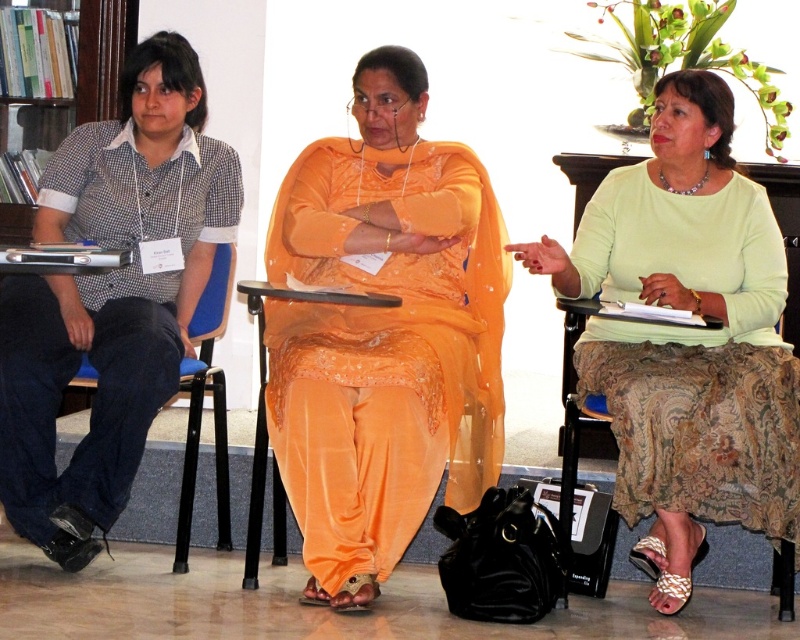
Who is more forward, (234, 170) or (218, 420)?

Point (218, 420) is in front.

You are a GUI agent. You are given a task and a screenshot of the screen. Output one action in this format:
    pyautogui.click(x=<x>, y=<y>)
    Task: Click on the checkered fabric shirt at left
    
    Given the screenshot: What is the action you would take?
    pyautogui.click(x=112, y=296)

Where is `checkered fabric shirt at left`? This screenshot has height=640, width=800. checkered fabric shirt at left is located at coordinates (112, 296).

Does point (444, 236) lie behind point (193, 452)?

That is False.

In the scene shown: Is orange silk dress at center further to camera compared to blue fabric chair at left?

No, orange silk dress at center is closer to the viewer.

Is point (336, 534) closer to camera compared to point (197, 300)?

Yes.

The height and width of the screenshot is (640, 800). Find the location of `orange silk dress at center`. orange silk dress at center is located at coordinates (384, 333).

Does orange silk dress at center have a smaller size compared to green satin blouse at center?

Yes.

Does orange silk dress at center have a greater width compared to green satin blouse at center?

Incorrect, orange silk dress at center's width does not surpass green satin blouse at center's.

The height and width of the screenshot is (640, 800). Describe the element at coordinates (384, 333) in the screenshot. I see `orange silk dress at center` at that location.

Locate an element on the screen. The width and height of the screenshot is (800, 640). orange silk dress at center is located at coordinates (384, 333).